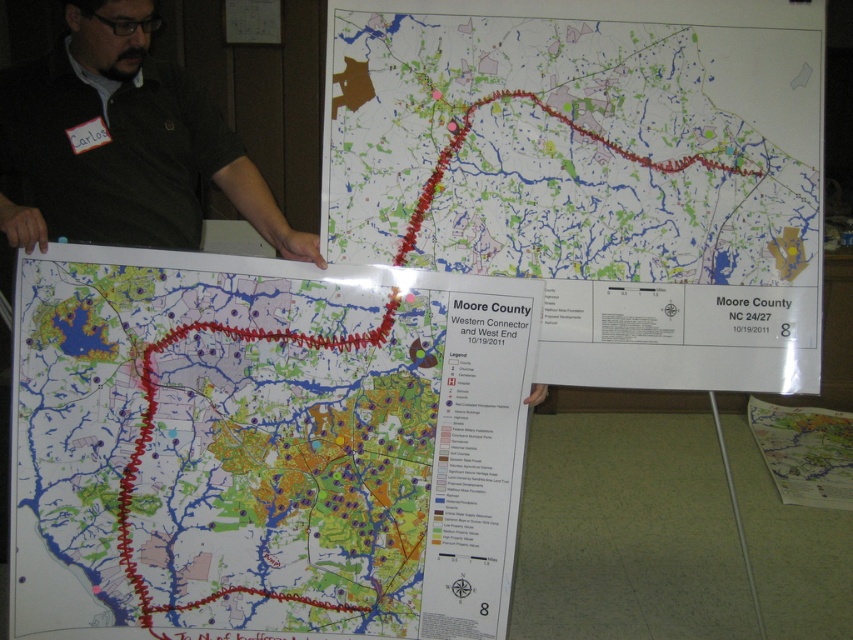
From the picture: Is dark green shirt at upper left in front of map paper at center?

That is True.

Between dark green shirt at upper left and map paper at center, which one is positioned lower?

map paper at center is below.

Is point (12, 116) closer to viewer compared to point (840, 442)?

Yes, it is.

Find the location of `dark green shirt at upper left`. dark green shirt at upper left is located at coordinates (123, 145).

Between point (184, 493) and point (163, 218), which one is positioned behind?

The point (163, 218) is behind.

Is the position of matte paper map at center more distant than that of dark green shirt at upper left?

That is True.

Between point (312, 480) and point (25, 152), which one is positioned in front?

Point (312, 480) is more forward.

Where is `matte paper map at center`? The height and width of the screenshot is (640, 853). matte paper map at center is located at coordinates (263, 448).

Does white paper map at center have a lesser width compared to map paper at center?

In fact, white paper map at center might be wider than map paper at center.

Can you confirm if white paper map at center is positioned above map paper at center?

Correct, white paper map at center is located above map paper at center.

Which is in front, point (534, 122) or point (827, 472)?

Point (534, 122) is more forward.

At what (x,y) coordinates should I click in order to perform the action: click on white paper map at center. Please return your answer as a coordinate pair (x, y). Image resolution: width=853 pixels, height=640 pixels. Looking at the image, I should click on (595, 173).